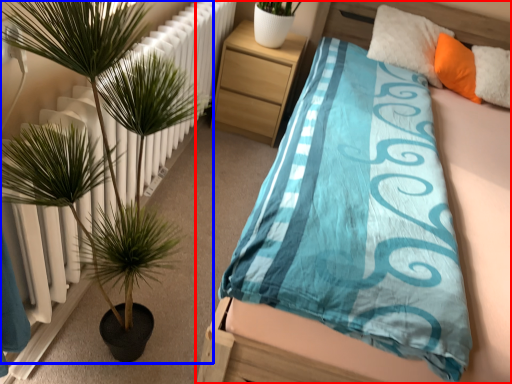
Question: Which of the following is the closest to the observer, bed (highlighted by a red box) or houseplant (highlighted by a blue box)?

Choices:
 (A) bed
 (B) houseplant

Answer: (B)